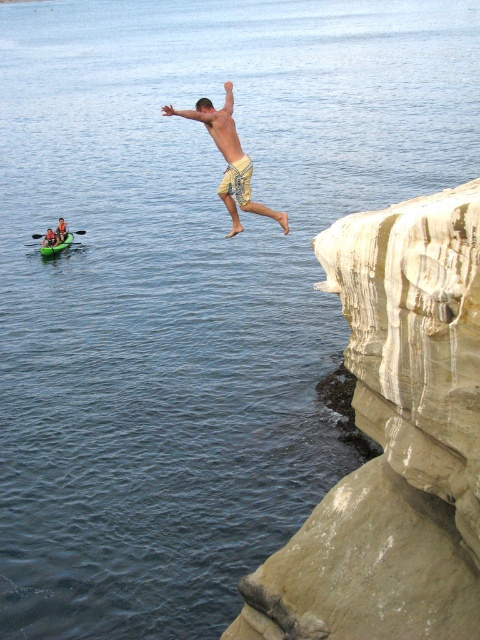
Is light beige rock at right thinner than tan textured shorts at center?

No, light beige rock at right is not thinner than tan textured shorts at center.

Is light beige rock at right closer to camera compared to tan textured shorts at center?

Yes, light beige rock at right is closer to the viewer.

What do you see at coordinates (394, 440) in the screenshot?
I see `light beige rock at right` at bounding box center [394, 440].

Find the location of a particular element. light beige rock at right is located at coordinates (394, 440).

Does light beige rock at right have a lesser width compared to tan textured shorts at upper center?

No.

Which is in front, point (424, 612) or point (57, 243)?

Positioned in front is point (424, 612).

The image size is (480, 640). Identify the location of light beige rock at right. (394, 440).

Does light beige rock at right have a greater height compared to green plastic paddle at left?

Yes.

Where is `light beige rock at right`? light beige rock at right is located at coordinates (394, 440).